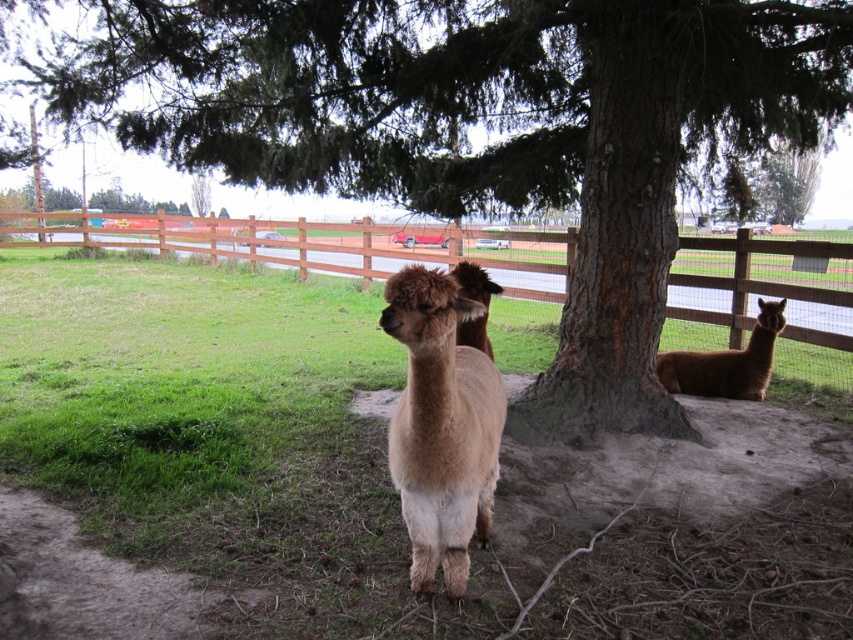
Looking at this image, does green grass at lower left appear on the left side of brown rough tree at center?

Indeed, green grass at lower left is positioned on the left side of brown rough tree at center.

Is green grass at lower left closer to camera compared to brown rough tree at center?

Yes, green grass at lower left is in front of brown rough tree at center.

You are a GUI agent. You are given a task and a screenshot of the screen. Output one action in this format:
    pyautogui.click(x=<x>, y=<y>)
    Task: Click on the green grass at lower left
    
    Given the screenshot: What is the action you would take?
    pyautogui.click(x=227, y=440)

Is green grass at lower left further to camera compared to fuzzy brown alpaca at center?

Yes, green grass at lower left is behind fuzzy brown alpaca at center.

Measure the distance from green grass at lower left to fuzzy brown alpaca at center.

They are 6.49 feet apart.

Identify the location of green grass at lower left. (227, 440).

Can you confirm if brown rough tree at center is bigger than brown wooden fence at center?

Actually, brown rough tree at center might be smaller than brown wooden fence at center.

Which is behind, point (165, 118) or point (218, 246)?

Positioned behind is point (218, 246).

Locate an element on the screen. Image resolution: width=853 pixels, height=640 pixels. brown rough tree at center is located at coordinates (485, 124).